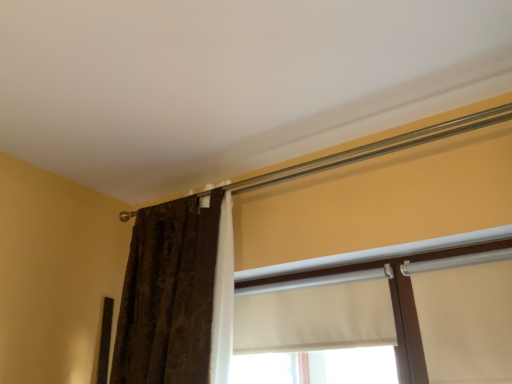
Question: Should I look upward or downward to see white matte window at center, marked as the 1th window in a left-to-right arrangement?

Choices:
 (A) up
 (B) down

Answer: (B)

Question: Considering the relative positions of white matte window at center, which is counted as the second window, starting from the right, and white fabric at center, the second window positioned from the left, in the image provided, is white matte window at center, which is counted as the second window, starting from the right, to the left of white fabric at center, the second window positioned from the left, from the viewer's perspective?

Choices:
 (A) yes
 (B) no

Answer: (A)

Question: Does white matte window at center, marked as the 1th window in a left-to-right arrangement, have a lesser height compared to white fabric at center, the second window positioned from the left?

Choices:
 (A) no
 (B) yes

Answer: (B)

Question: Does white matte window at center, which is counted as the second window, starting from the right, contain white fabric at center, the 1th window positioned from the right?

Choices:
 (A) yes
 (B) no

Answer: (B)

Question: Can you confirm if white matte window at center, marked as the 1th window in a left-to-right arrangement, is positioned to the right of white fabric at center, the 1th window positioned from the right?

Choices:
 (A) no
 (B) yes

Answer: (A)

Question: Considering the relative sizes of white matte window at center, which is counted as the second window, starting from the right, and white fabric at center, the second window positioned from the left, in the image provided, is white matte window at center, which is counted as the second window, starting from the right, bigger than white fabric at center, the second window positioned from the left,?

Choices:
 (A) no
 (B) yes

Answer: (A)

Question: Are white matte window at center, marked as the 1th window in a left-to-right arrangement, and white fabric at center, the 1th window positioned from the right, beside each other?

Choices:
 (A) yes
 (B) no

Answer: (A)

Question: Does white fabric at center, the 1th window positioned from the right, have a greater height compared to brown textured curtain at left?

Choices:
 (A) yes
 (B) no

Answer: (B)

Question: From a real-world perspective, is white fabric at center, the second window positioned from the left, under brown textured curtain at left?

Choices:
 (A) yes
 (B) no

Answer: (A)

Question: Is white fabric at center, the 1th window positioned from the right, next to brown textured curtain at left and touching it?

Choices:
 (A) no
 (B) yes

Answer: (A)

Question: Is brown textured curtain at left at the back of white fabric at center, the 1th window positioned from the right?

Choices:
 (A) no
 (B) yes

Answer: (A)

Question: Is white fabric at center, the second window positioned from the left, bigger than brown textured curtain at left?

Choices:
 (A) yes
 (B) no

Answer: (B)

Question: Considering the relative positions of white fabric at center, the 1th window positioned from the right, and brown textured curtain at left in the image provided, is white fabric at center, the 1th window positioned from the right, to the right of brown textured curtain at left from the viewer's perspective?

Choices:
 (A) no
 (B) yes

Answer: (B)

Question: Considering the relative sizes of white fabric at center, the 1th window positioned from the right, and white matte window at center, which is counted as the second window, starting from the right, in the image provided, is white fabric at center, the 1th window positioned from the right, thinner than white matte window at center, which is counted as the second window, starting from the right,?

Choices:
 (A) yes
 (B) no

Answer: (B)